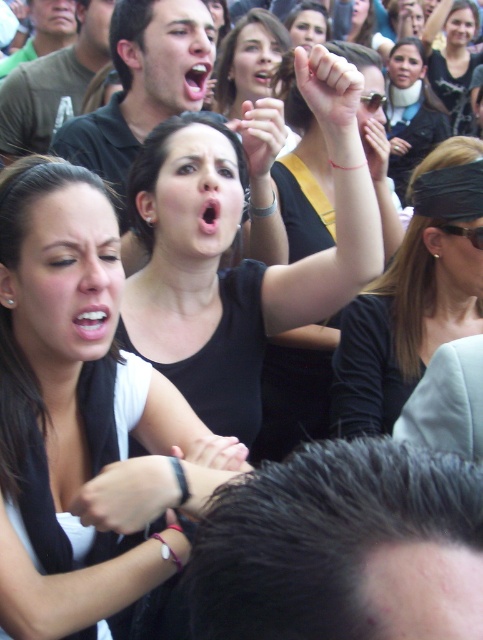
Question: Which point is closer to the camera?

Choices:
 (A) (158, 513)
 (B) (366, 128)

Answer: (A)

Question: Which object appears closest to the camera in this image?

Choices:
 (A) black matte shirt at upper center
 (B) black bandana at upper right
 (C) matte black hand at upper center
 (D) matte black fist at center

Answer: (A)

Question: Is black matte shirt at upper center to the left of matte black shirt at upper right from the viewer's perspective?

Choices:
 (A) no
 (B) yes

Answer: (B)

Question: Is black bandana at upper right positioned at the back of matte black fist at center?

Choices:
 (A) no
 (B) yes

Answer: (B)

Question: Estimate the real-world distances between objects in this image. Which object is closer to the white skin at raised fist?

Choices:
 (A) matte black shirt at upper right
 (B) matte black hand at upper center
 (C) black leather wristband at lower center

Answer: (B)

Question: Does black matte shirt at center appear on the right side of black bandana at upper right?

Choices:
 (A) no
 (B) yes

Answer: (A)